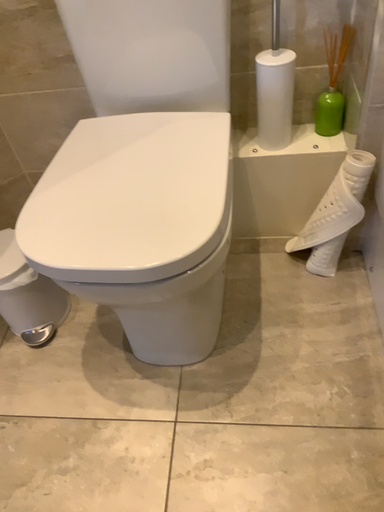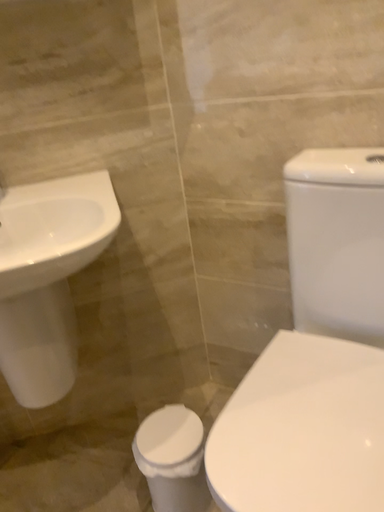
Question: Which way did the camera rotate in the video?

Choices:
 (A) rotated left
 (B) rotated right

Answer: (A)